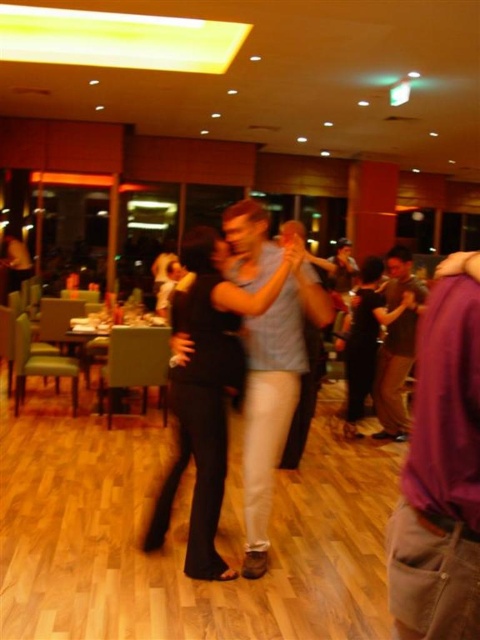
You are a photographer at the event and want to capture a photo of both the purple cotton shirt at right and the brown cotton shirt at right in the same frame. Based on their positions, which one should you focus on first to ensure both are in focus?

The purple cotton shirt at right is below the brown cotton shirt at right, so you should focus on the brown cotton shirt at right first to ensure both are in focus since it is higher up and the camera can capture the lower one automatically.

In the dance hall scene, there are two shirts visible. The light blue cotton shirt at center and the brown cotton shirt at right. Which shirt is positioned more to the left side of the scene?

The light blue cotton shirt at center is positioned more to the left side of the scene than the brown cotton shirt at right.

You are standing at the entrance of the dance hall and want to locate the purple cotton shirt at right. According to the coordinates given, where should you look?

The purple cotton shirt at right is located at coordinates point (442, 470), which is near the bottom right of the image.